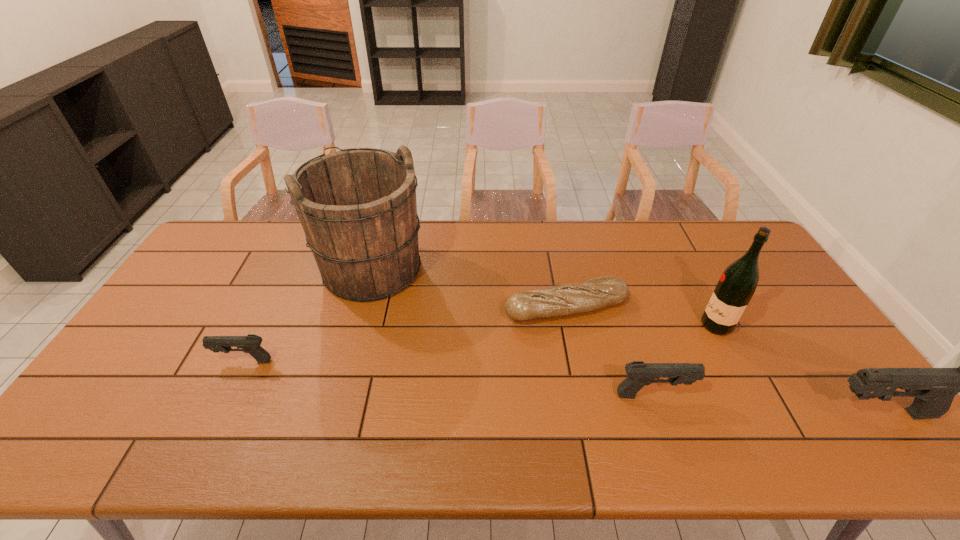
The image size is (960, 540). Find the location of `free space located at the barrel of the leftmost pistol`. free space located at the barrel of the leftmost pistol is located at coordinates (179, 361).

Locate an element on the screen. Image resolution: width=960 pixels, height=540 pixels. blank space located 0.170m at the barrel of the leftmost pistol is located at coordinates (153, 361).

Find the location of a particular element. This screenshot has height=540, width=960. vacant region located at the barrel of the second shortest pistol is located at coordinates (758, 395).

Locate an element on the screen. This screenshot has width=960, height=540. free space located 0.350m at the barrel of the rightmost object is located at coordinates pos(682,414).

You are a GUI agent. You are given a task and a screenshot of the screen. Output one action in this format:
    pyautogui.click(x=<x>, y=<y>)
    Task: Click on the free point located at the barrel of the rightmost object
    
    Given the screenshot: What is the action you would take?
    pyautogui.click(x=732, y=414)

Identify the location of free location located 0.230m at the barrel of the rightmost object. (732, 414).

Identify the location of vacant space located on the back of the shortest object. This screenshot has height=540, width=960. (550, 226).

This screenshot has width=960, height=540. In order to click on blank space located on the front of the bucket in this screenshot , I will do `click(336, 401)`.

This screenshot has width=960, height=540. I want to click on vacant space located 0.340m on the front-facing side of the second object from right to left, so click(x=585, y=325).

The height and width of the screenshot is (540, 960). Find the location of `vacant space located on the front-facing side of the second object from right to left`. vacant space located on the front-facing side of the second object from right to left is located at coordinates (612, 325).